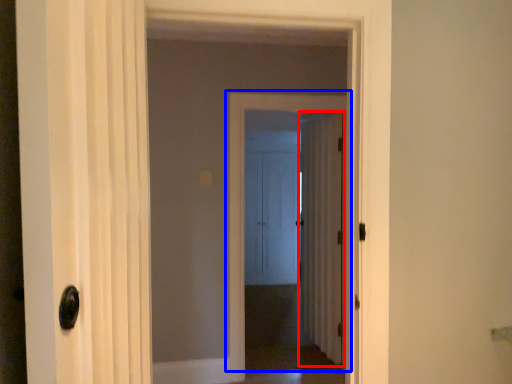
Question: Among these objects, which one is farthest to the camera, door (highlighted by a red box) or door (highlighted by a blue box)?

Choices:
 (A) door
 (B) door

Answer: (A)